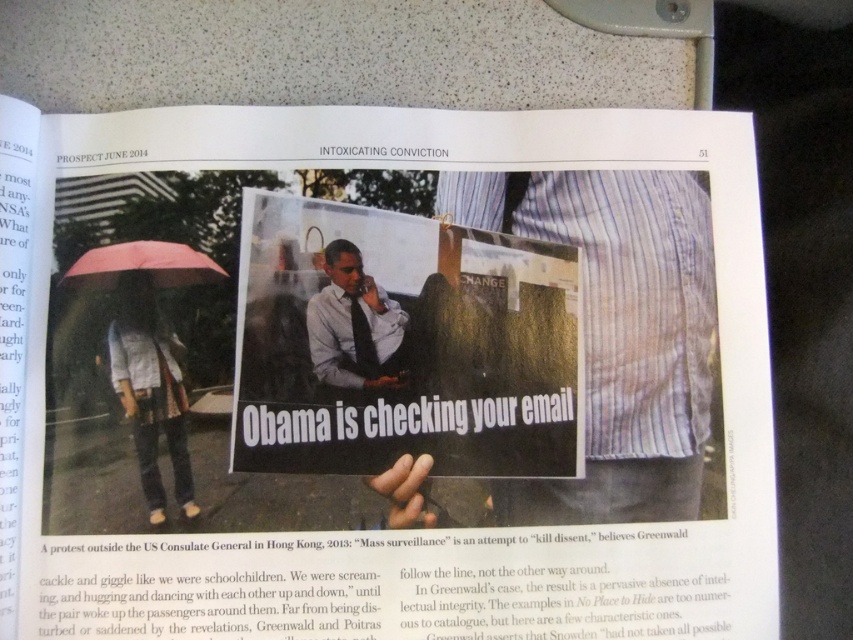
Can you confirm if white paper poster at center is shorter than light blue shirt at center?

No.

Does point (352, 266) come farther from viewer compared to point (335, 365)?

Yes, point (352, 266) is behind point (335, 365).

Between point (344, 298) and point (349, 326), which one is positioned in front?

Point (349, 326)

Identify the location of white paper poster at center. (402, 346).

Which is more to the left, light blue shirt at center or pink matte umbrella at upper left?

From the viewer's perspective, pink matte umbrella at upper left appears more on the left side.

Does light blue shirt at center lie in front of pink matte umbrella at upper left?

No, light blue shirt at center is behind pink matte umbrella at upper left.

Find the location of a particular element. light blue shirt at center is located at coordinates (354, 324).

Is white paper poster at center positioned in front of denim jacket at lower left?

No, it is behind denim jacket at lower left.

Which of these two, white paper poster at center or denim jacket at lower left, stands shorter?

With less height is denim jacket at lower left.

Does point (532, 433) come in front of point (152, 460)?

No, it is behind (152, 460).

The height and width of the screenshot is (640, 853). I want to click on white paper poster at center, so click(402, 346).